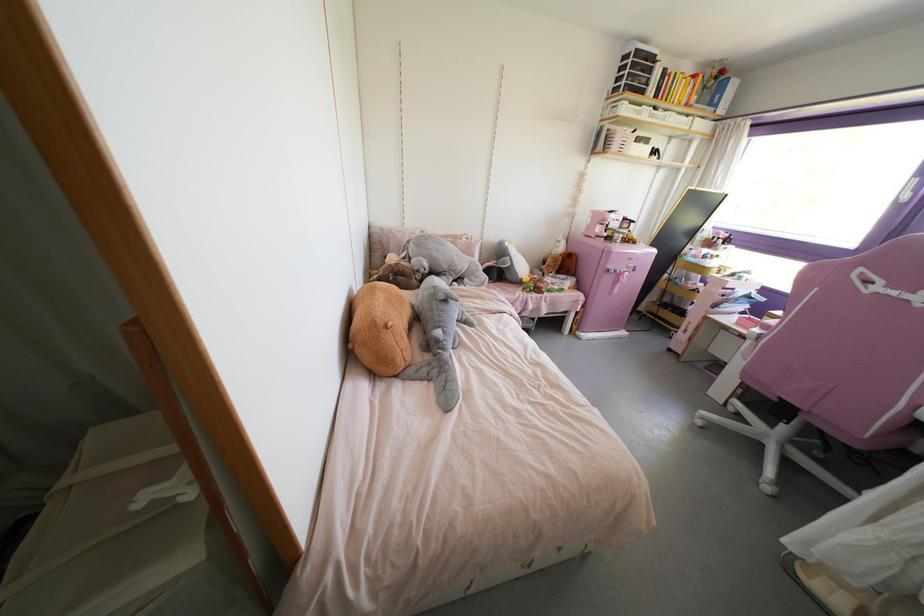
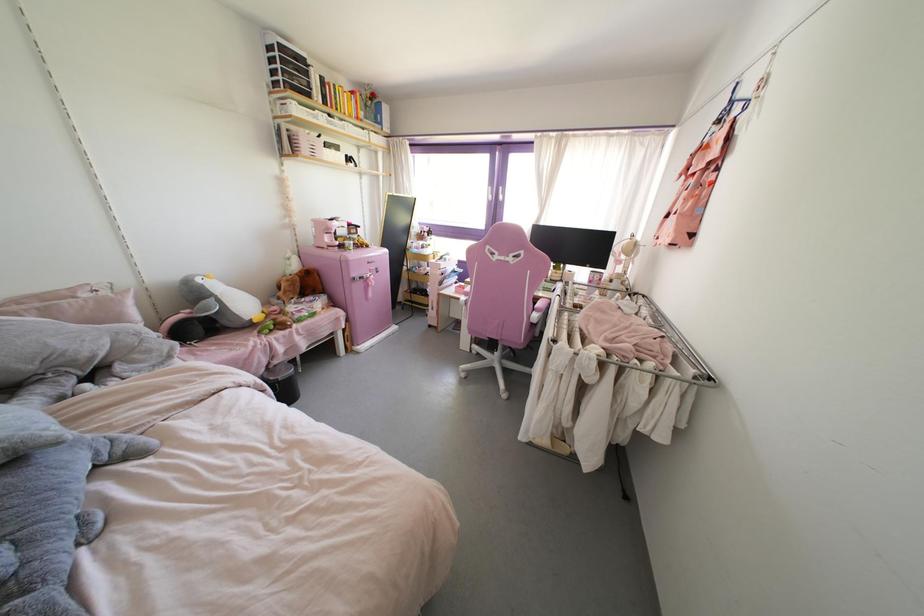
Locate, in the second image, the point that corresponds to the point at 639,145 in the first image.

(333, 151)